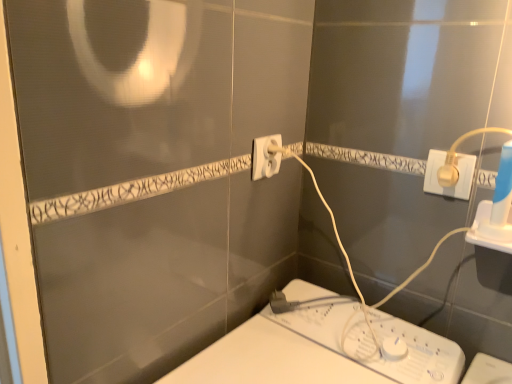
Question: Considering the relative sizes of white plastic plug at center, which is counted as the 1th power plugs and sockets, starting from the left, and white plastic plug at upper right, positioned as the 2th power plugs and sockets in left-to-right order, in the image provided, is white plastic plug at center, which is counted as the 1th power plugs and sockets, starting from the left, wider than white plastic plug at upper right, positioned as the 2th power plugs and sockets in left-to-right order,?

Choices:
 (A) no
 (B) yes

Answer: (B)

Question: Is white plastic plug at center, the second power plugs and sockets when ordered from right to left, closer to the viewer compared to white plastic plug at upper right, which is the first power plugs and sockets from front to back?

Choices:
 (A) no
 (B) yes

Answer: (A)

Question: Does white plastic plug at center, the second power plugs and sockets when ordered from right to left, appear on the left side of white plastic plug at upper right, acting as the second power plugs and sockets starting from the back?

Choices:
 (A) no
 (B) yes

Answer: (B)

Question: Is white plastic plug at center, the second power plugs and sockets when ordered from right to left, not close to white plastic plug at upper right, which is the first power plugs and sockets from front to back?

Choices:
 (A) no
 (B) yes

Answer: (A)

Question: From a real-world perspective, is white plastic plug at center, which is counted as the 1th power plugs and sockets, starting from the left, positioned under white plastic plug at upper right, which is the 1th power plugs and sockets in right-to-left order, based on gravity?

Choices:
 (A) no
 (B) yes

Answer: (A)

Question: Could white plastic plug at upper right, which is the first power plugs and sockets from front to back, be considered to be inside white plastic plug at center, which ranks as the second power plugs and sockets in front-to-back order?

Choices:
 (A) yes
 (B) no

Answer: (B)

Question: Are white plastic plug at upper right, acting as the second power plugs and sockets starting from the back, and white plastic plug at center, which is counted as the 1th power plugs and sockets, starting from the left, making contact?

Choices:
 (A) yes
 (B) no

Answer: (B)

Question: Is white plastic plug at upper right, positioned as the 2th power plugs and sockets in left-to-right order, facing towards white plastic plug at center, which is counted as the 1th power plugs and sockets, starting from the left?

Choices:
 (A) yes
 (B) no

Answer: (B)

Question: Can you confirm if white plastic plug at upper right, which is the 1th power plugs and sockets in right-to-left order, is positioned to the right of white plastic plug at center, the first power plugs and sockets from the back?

Choices:
 (A) no
 (B) yes

Answer: (B)

Question: Is white plastic plug at center, the first power plugs and sockets from the back, at the back of white plastic plug at upper right, positioned as the 2th power plugs and sockets in left-to-right order?

Choices:
 (A) no
 (B) yes

Answer: (A)

Question: Is white plastic plug at upper right, which is the first power plugs and sockets from front to back, further to the viewer compared to white plastic plug at center, which is counted as the 1th power plugs and sockets, starting from the left?

Choices:
 (A) no
 (B) yes

Answer: (A)

Question: Does white plastic plug at upper right, acting as the second power plugs and sockets starting from the back, have a larger size compared to white plastic plug at center, the first power plugs and sockets from the back?

Choices:
 (A) no
 (B) yes

Answer: (A)

Question: Relative to white plastic plug at center, the second power plugs and sockets when ordered from right to left, is white plastic plug at upper right, acting as the second power plugs and sockets starting from the back, in front or behind?

Choices:
 (A) front
 (B) behind

Answer: (A)